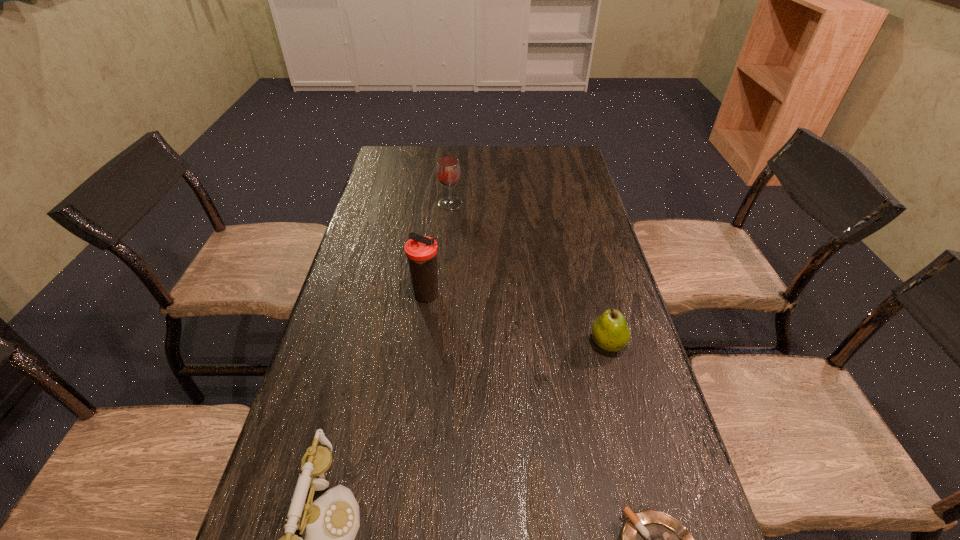
You are a GUI agent. You are given a task and a screenshot of the screen. Output one action in this format:
    pyautogui.click(x=<x>, y=<y>)
    Task: Click on the tallest object
    This screenshot has width=960, height=540.
    Given the screenshot: What is the action you would take?
    pyautogui.click(x=421, y=251)

Locate an element on the screen. the second farthest object is located at coordinates (421, 251).

Locate an element on the screen. The height and width of the screenshot is (540, 960). the farthest object is located at coordinates (448, 170).

Where is `the third nearest object`? The image size is (960, 540). the third nearest object is located at coordinates (610, 332).

Image resolution: width=960 pixels, height=540 pixels. What are the coordinates of `free space located 0.110m on the front of the fourth nearest object` in the screenshot? It's located at pyautogui.click(x=421, y=342).

Image resolution: width=960 pixels, height=540 pixels. Find the location of `free space located 0.080m on the right of the wineglass`. free space located 0.080m on the right of the wineglass is located at coordinates (486, 204).

Find the location of a particular element. vacant space located 0.080m on the back of the pear is located at coordinates (597, 306).

At what (x,y) coordinates should I click in order to perform the action: click on object located at the right edge. Please return your answer as a coordinate pair (x, y). This screenshot has height=540, width=960. Looking at the image, I should click on (610, 332).

This screenshot has width=960, height=540. In the image, there is a desktop. What are the coordinates of `free space at the far edge` in the screenshot? It's located at (473, 167).

Where is `vacant space at the left edge`? Image resolution: width=960 pixels, height=540 pixels. vacant space at the left edge is located at coordinates (344, 294).